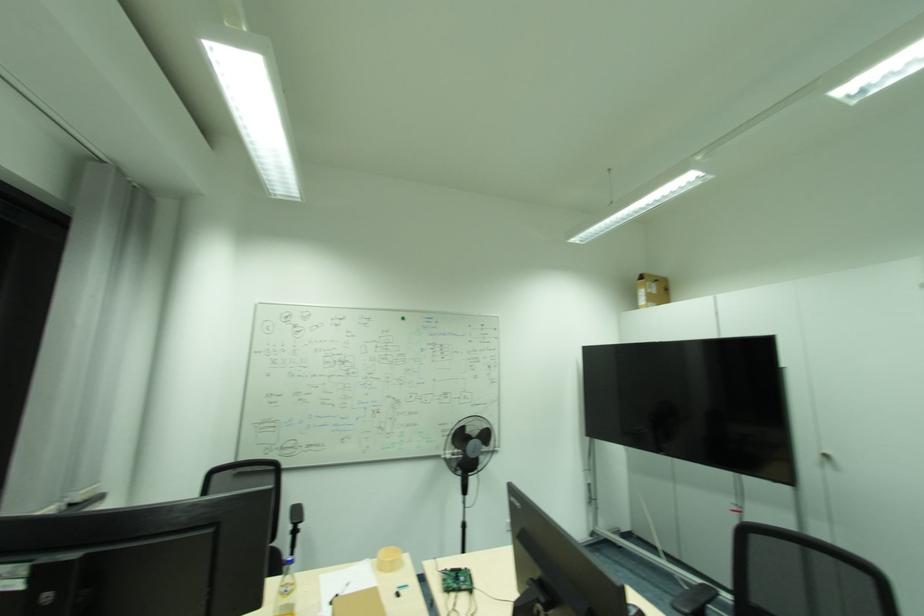
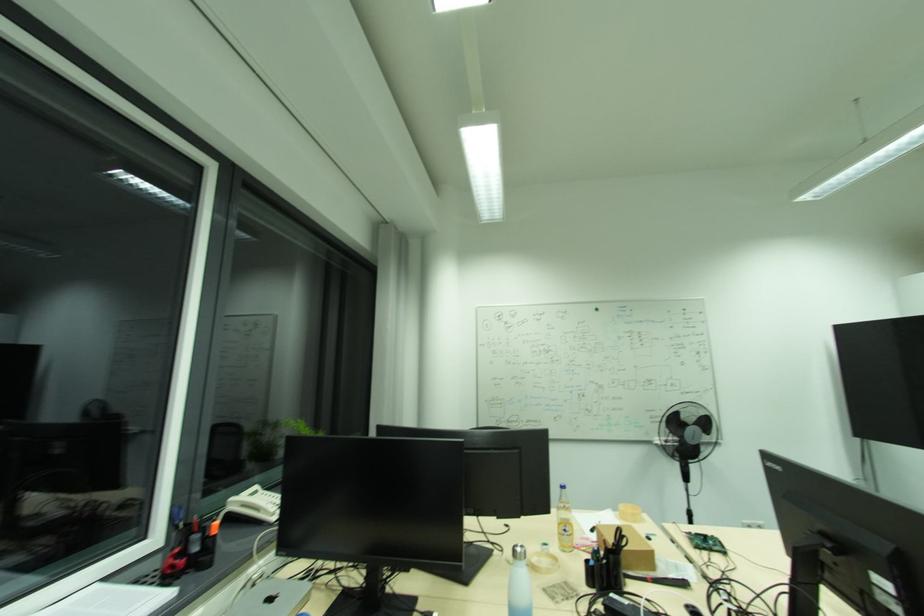
Which direction would the cameraman need to move to produce the second image?

The movement direction of the cameraman is left, backward.